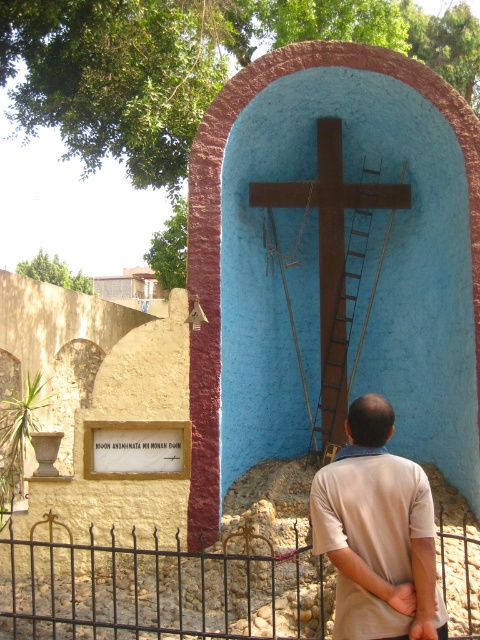
Is beige cotton shirt at center wider than brown wooden cross at center?

In fact, beige cotton shirt at center might be narrower than brown wooden cross at center.

Which is behind, point (337, 492) or point (376, 193)?

Positioned behind is point (376, 193).

The width and height of the screenshot is (480, 640). I want to click on beige cotton shirt at center, so click(377, 532).

Measure the distance between black wrought iron fence at lower center and camera.

5.19 meters

How much distance is there between black wrought iron fence at lower center and brown wooden cross at center?

black wrought iron fence at lower center is 8.85 feet from brown wooden cross at center.

Is point (127, 609) positioned before point (374, 284)?

That is True.

This screenshot has height=640, width=480. I want to click on black wrought iron fence at lower center, so click(159, 589).

Can you confirm if black wrought iron fence at lower center is shorter than beige cotton shirt at center?

Correct, black wrought iron fence at lower center is not as tall as beige cotton shirt at center.

Between point (457, 536) and point (372, 496), which one is positioned in front?

Positioned in front is point (372, 496).

Is point (464, 586) more distant than point (364, 625)?

Yes, point (464, 586) is behind point (364, 625).

The image size is (480, 640). I want to click on black wrought iron fence at lower center, so click(159, 589).